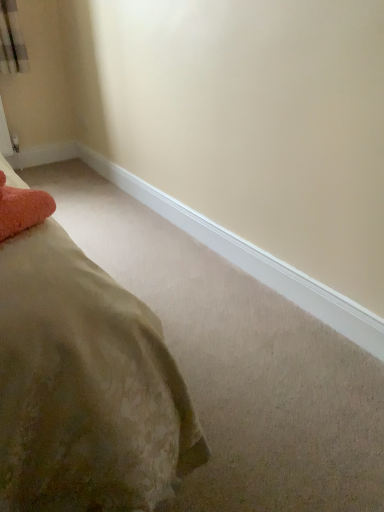
Image resolution: width=384 pixels, height=512 pixels. What do you see at coordinates (85, 387) in the screenshot? I see `beige fabric bed at lower left` at bounding box center [85, 387].

In order to face beige fabric bed at lower left, should I rotate leftwards or rightwards?

Turn left approximately 14.727 degrees to face it.

What is the approximate height of beige fabric bed at lower left?

The height of beige fabric bed at lower left is 1.94 inches.

You are a GUI agent. You are given a task and a screenshot of the screen. Output one action in this format:
    pyautogui.click(x=<x>, y=<y>)
    Task: Click on the beige fabric bed at lower left
    The height and width of the screenshot is (512, 384).
    Given the screenshot: What is the action you would take?
    pyautogui.click(x=85, y=387)

You are a GUI agent. You are given a task and a screenshot of the screen. Output one action in this format:
    pyautogui.click(x=<x>, y=<y>)
    Task: Click on the beige fabric bed at lower left
    Image resolution: width=384 pixels, height=512 pixels.
    Given the screenshot: What is the action you would take?
    pyautogui.click(x=85, y=387)